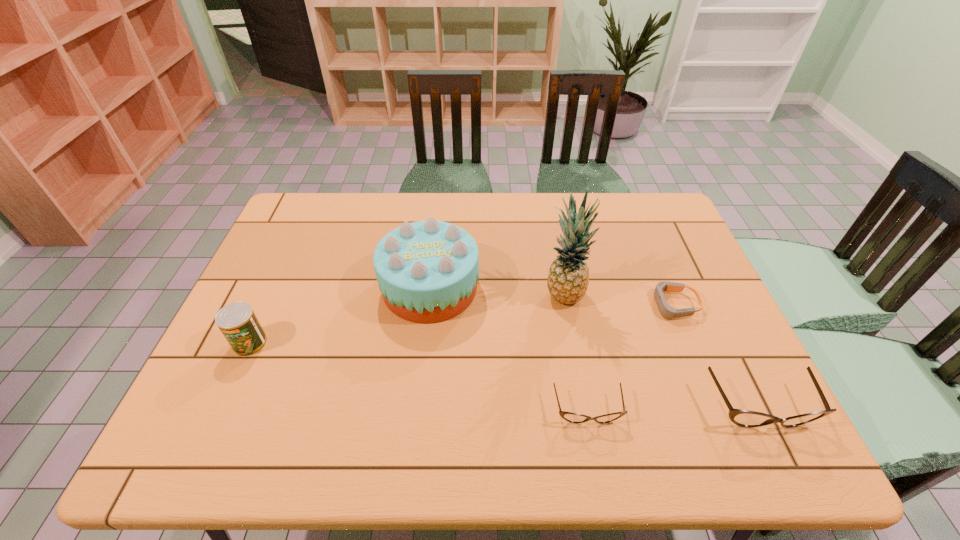
Locate an element on the screen. The height and width of the screenshot is (540, 960). the fifth tallest object is located at coordinates (571, 417).

This screenshot has width=960, height=540. Find the location of `the shorter spectacles`. the shorter spectacles is located at coordinates (571, 417).

Locate an element on the screen. This screenshot has width=960, height=540. the right spectacles is located at coordinates (744, 418).

The image size is (960, 540). In order to click on the taller spectacles in this screenshot , I will do `click(744, 418)`.

Locate an element on the screen. the fourth shortest object is located at coordinates (237, 321).

The width and height of the screenshot is (960, 540). Find the location of `the leftmost object`. the leftmost object is located at coordinates (237, 321).

The image size is (960, 540). Identify the location of the tallest object. (568, 278).

Find the location of a particular element. The width and height of the screenshot is (960, 540). the second tallest object is located at coordinates (427, 271).

Find the location of a particular element. Image resolution: width=960 pixels, height=540 pixels. the second object from left to right is located at coordinates (427, 271).

The height and width of the screenshot is (540, 960). I want to click on the shortest object, so click(x=667, y=311).